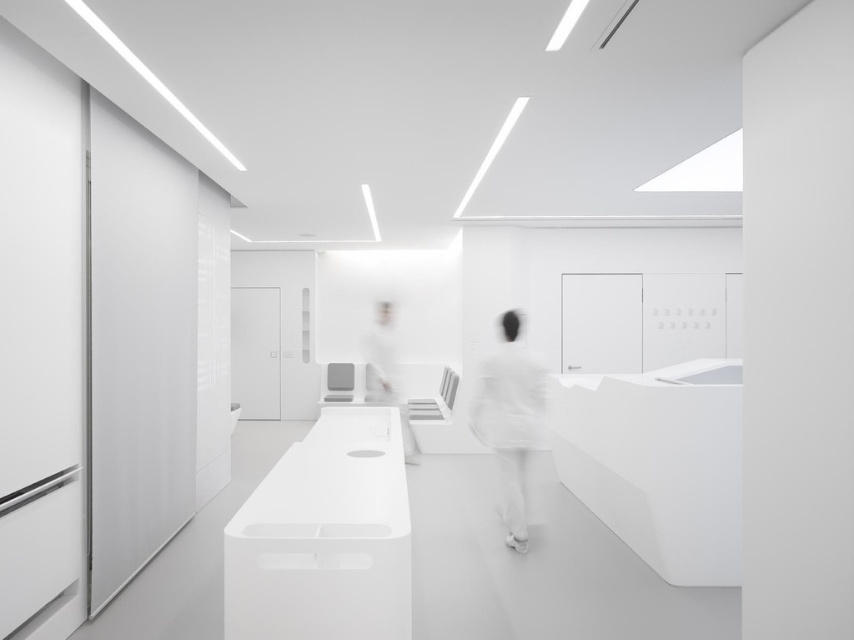
Who is higher up, white matte uniform at center or white glossy person at center?

white glossy person at center is higher up.

The height and width of the screenshot is (640, 854). Describe the element at coordinates (510, 419) in the screenshot. I see `white matte uniform at center` at that location.

Locate an element on the screen. white matte uniform at center is located at coordinates (510, 419).